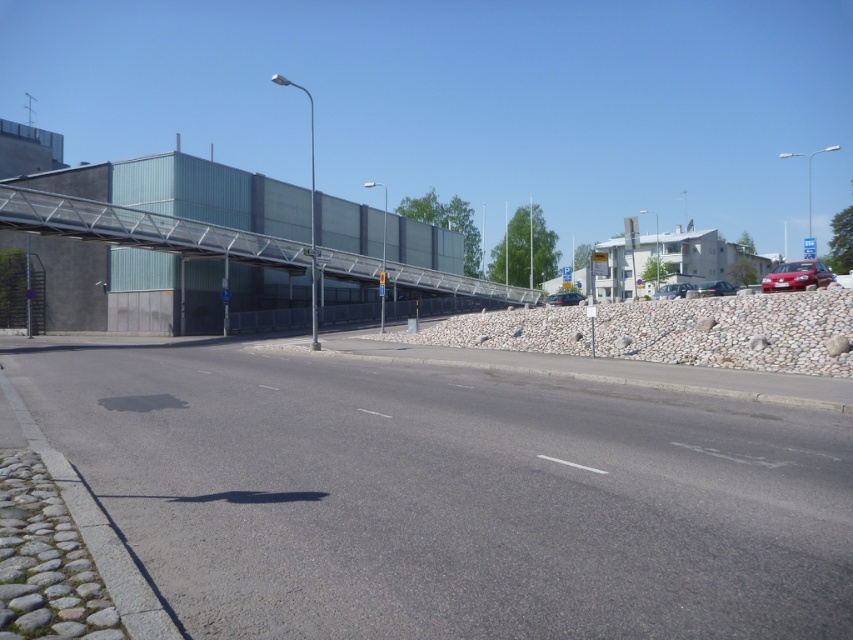
You are a city planner reviewing the urban street scene. You notice the metallic gray overpass at center and the blue plastic sign at upper right. Which object would you say is smaller in size?

The metallic gray overpass at center is smaller in size compared to the blue plastic sign at upper right.

You are a delivery driver who needs to navigate under the metallic gray overpass at center and the blue plastic sign at upper right. Which structure will you have to lower your truck bed to avoid hitting?

The metallic gray overpass at center is shorter than the blue plastic sign at upper right, so you will need to lower your truck bed to avoid hitting the metallic gray overpass at center.